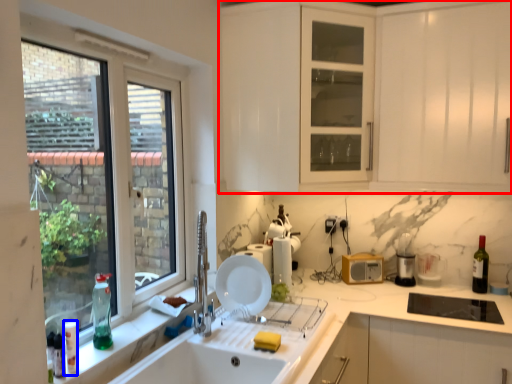
Question: Among these objects, which one is nearest to the camera, cabinetry (highlighted by a red box) or bottle (highlighted by a blue box)?

Choices:
 (A) cabinetry
 (B) bottle

Answer: (B)